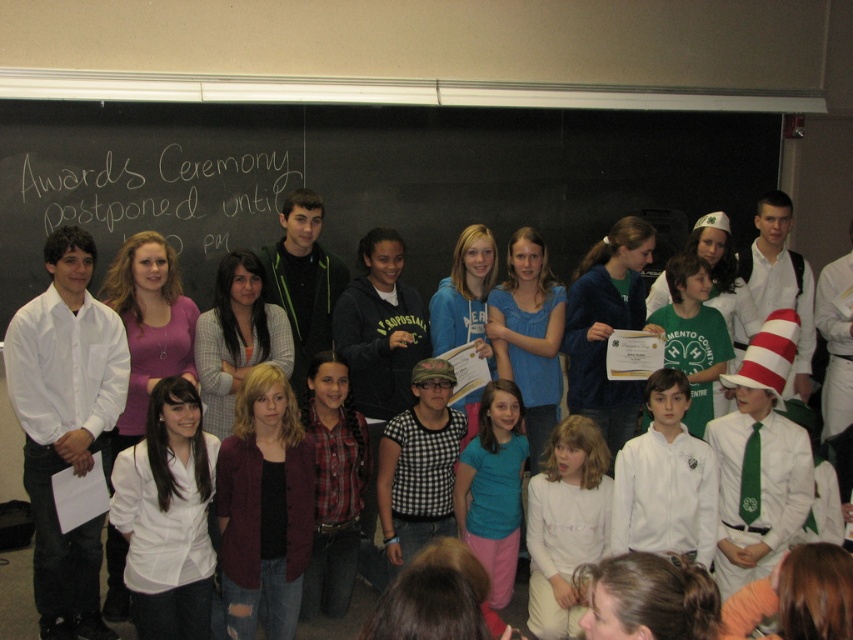
You are organizing a photo shoot and want to ensure that all participants are visible in the frame. Given that the teal matte shirt at center and the white striped hat at right are part of the group, which object should you focus on to ensure the narrower one is properly framed?

The teal matte shirt at center has a smaller width than the white striped hat at right, so you should focus on framing the teal matte shirt at center to ensure the narrower object is properly visible.

You are a photographer trying to capture a group photo of the white shirt at center and the green cotton shirt at center. Which one should you focus on first if you want to ensure both are in focus, given their positions relative to the camera?

The white shirt at center is located below the green cotton shirt at center. To ensure both are in focus, focus on the green cotton shirt at center first since it is closer to the camera, and the depth of field will naturally include the white shirt at center below it.